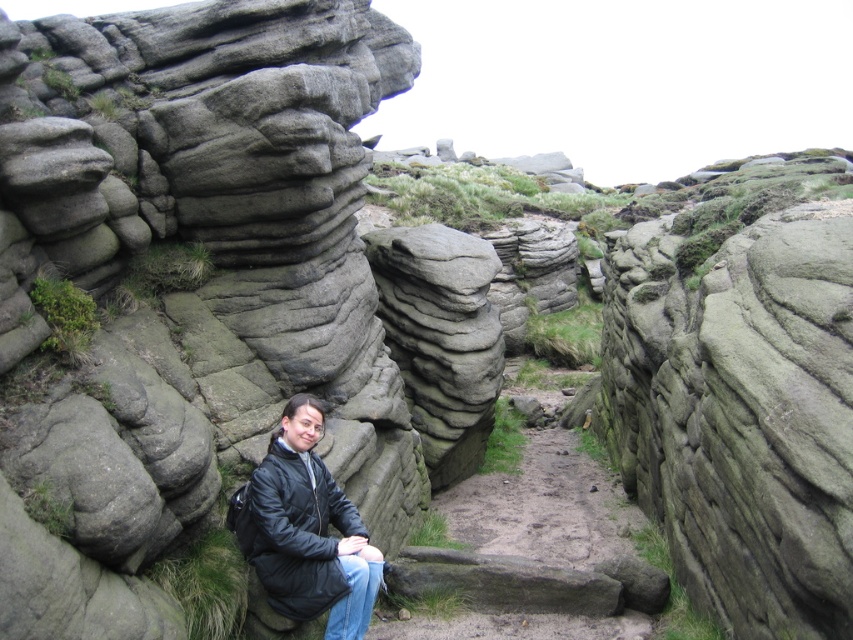
You are a hiker trying to find your way back to the trailhead. You see a dull gray stone path at center and a black matte jacket at center. Which object is located to the right of the other?

The dull gray stone path at center is positioned on the right side of black matte jacket at center, so the path is to the right of the jacket.

You are standing at the origin point of the coordinate system in this image. You want to walk towards the dull gray stone path at center. What direction should you move in?

Since the dull gray stone path at center is located at coordinate point (x=532, y=554), you should move towards the right and upward direction from your current position at the origin to reach it.

From the picture: You are standing at the point marked as point (532, 554) in the image. What object is directly beneath your feet?

The dull gray stone path at center is directly beneath your feet at point (532, 554).